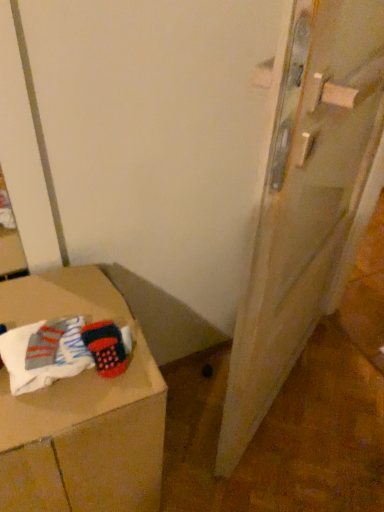
Where is `cardboard box at lower left`? cardboard box at lower left is located at coordinates (81, 412).

What is the approximate width of wooden door at right?

The width of wooden door at right is 7.06 inches.

Identify the location of white cotton socks at lower left. Image resolution: width=384 pixels, height=512 pixels. (63, 351).

Where is `cardboard box at lower left`? Image resolution: width=384 pixels, height=512 pixels. cardboard box at lower left is located at coordinates (81, 412).

In the scene shown: Considering the relative positions of wooden door at right and white cotton socks at lower left in the image provided, is wooden door at right to the left of white cotton socks at lower left from the viewer's perspective?

No, wooden door at right is not to the left of white cotton socks at lower left.

Which of these two, wooden door at right or white cotton socks at lower left, is smaller?

With smaller size is white cotton socks at lower left.

In terms of width, does wooden door at right look wider or thinner when compared to white cotton socks at lower left?

Clearly, wooden door at right has more width compared to white cotton socks at lower left.

Identify the location of laundry on the right of cardboard box at lower left. Image resolution: width=384 pixels, height=512 pixels. (63, 351).

Is cardboard box at lower left taller or shorter than white cotton socks at lower left?

cardboard box at lower left is taller than white cotton socks at lower left.

From a real-world perspective, does cardboard box at lower left stand above white cotton socks at lower left?

No, from a real-world perspective, cardboard box at lower left is not over white cotton socks at lower left

Is cardboard box at lower left oriented towards white cotton socks at lower left?

No, cardboard box at lower left is not oriented towards white cotton socks at lower left.

Considering the relative sizes of white cotton socks at lower left and cardboard box at lower left in the image provided, is white cotton socks at lower left thinner than cardboard box at lower left?

Yes, white cotton socks at lower left is thinner than cardboard box at lower left.

How many degrees apart are the facing directions of white cotton socks at lower left and cardboard box at lower left?

2.89 degrees.

Is point (47, 328) closer to viewer compared to point (62, 433)?

No, it is not.

Visually, is white cotton socks at lower left positioned to the left or to the right of cardboard box at lower left?

white cotton socks at lower left is positioned on cardboard box at lower left's right side.

Image resolution: width=384 pixels, height=512 pixels. Find the location of `door above the cardboard box at lower left (from the image's perspective)`. door above the cardboard box at lower left (from the image's perspective) is located at coordinates pyautogui.click(x=307, y=202).

Is wooden door at right aimed at cardboard box at lower left?

No, wooden door at right is not turned towards cardboard box at lower left.

Is the position of wooden door at right more distant than that of cardboard box at lower left?

No, it is in front of cardboard box at lower left.

Can you tell me how much white cotton socks at lower left and wooden door at right differ in facing direction?

The angle between the facing direction of white cotton socks at lower left and the facing direction of wooden door at right is 35.1 degrees.

Is white cotton socks at lower left to the right of wooden door at right from the viewer's perspective?

In fact, white cotton socks at lower left is to the left of wooden door at right.

Is white cotton socks at lower left directly adjacent to wooden door at right?

No, white cotton socks at lower left is not making contact with wooden door at right.

From a real-world perspective, which is physically above, white cotton socks at lower left or wooden door at right?

white cotton socks at lower left.

Considering the sizes of objects cardboard box at lower left and wooden door at right in the image provided, who is taller, cardboard box at lower left or wooden door at right?

wooden door at right.

Which object is thinner, cardboard box at lower left or wooden door at right?

Thinner between the two is wooden door at right.

Is cardboard box at lower left not within wooden door at right?

Absolutely, cardboard box at lower left is external to wooden door at right.

At what (x,y) coordinates should I click in order to perform the action: click on door below the white cotton socks at lower left (from a real-world perspective). Please return your answer as a coordinate pair (x, y). Image resolution: width=384 pixels, height=512 pixels. Looking at the image, I should click on (307, 202).

Where is `laundry that appears behind the cardboard box at lower left`? laundry that appears behind the cardboard box at lower left is located at coordinates tap(63, 351).

When comparing their distances from cardboard box at lower left, does wooden door at right or white cotton socks at lower left seem closer?

white cotton socks at lower left is positioned closer to the anchor cardboard box at lower left.

Looking at the image, which one is located closer to white cotton socks at lower left, cardboard box at lower left or wooden door at right?

The object closer to white cotton socks at lower left is cardboard box at lower left.

When comparing their distances from white cotton socks at lower left, does wooden door at right or cardboard box at lower left seem further?

wooden door at right is further to white cotton socks at lower left.

In the scene shown: From the image, which object appears to be nearer to wooden door at right, cardboard box at lower left or white cotton socks at lower left?

cardboard box at lower left.

Considering their positions, is white cotton socks at lower left positioned closer to cardboard box at lower left than wooden door at right?

white cotton socks at lower left.

When comparing their distances from wooden door at right, does white cotton socks at lower left or cardboard box at lower left seem further?

white cotton socks at lower left.

Identify the location of laundry between cardboard box at lower left and wooden door at right from left to right. The width and height of the screenshot is (384, 512). (63, 351).